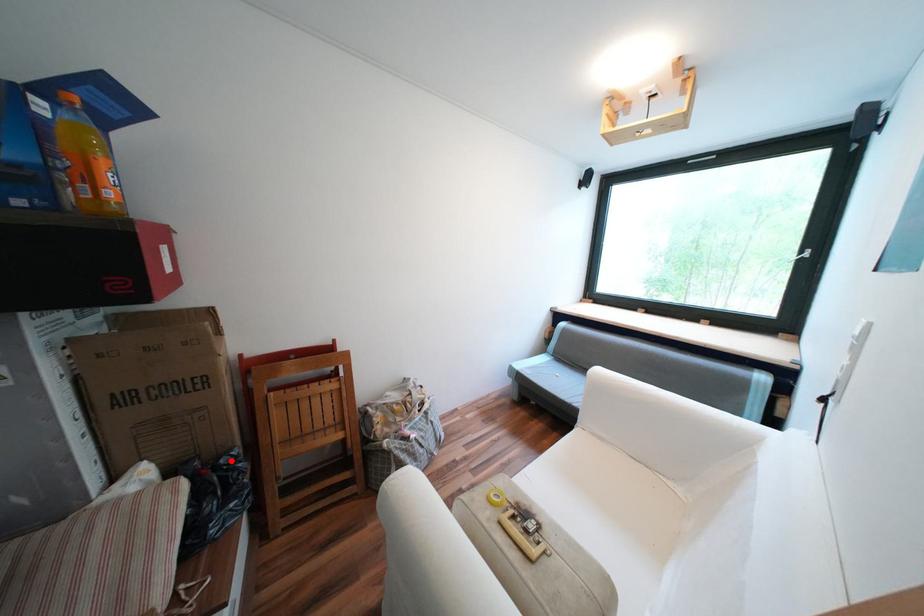
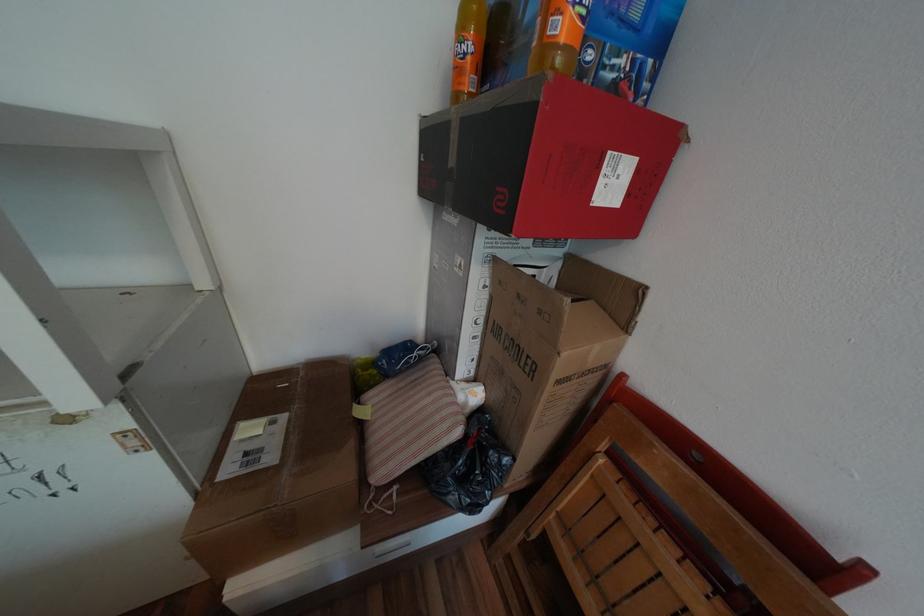
Locate, in the second image, the point that corresponds to the highlighted location in the first image.

(500, 453)